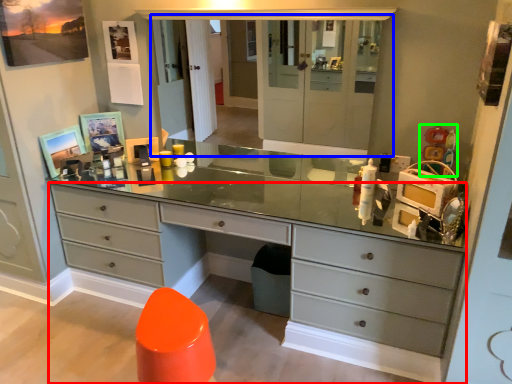
Question: Based on their relative distances, which object is farther from chest of drawers (highlighted by a red box)? Choose from medicine cabinet (highlighted by a blue box) and toy (highlighted by a green box).

Choices:
 (A) medicine cabinet
 (B) toy

Answer: (B)